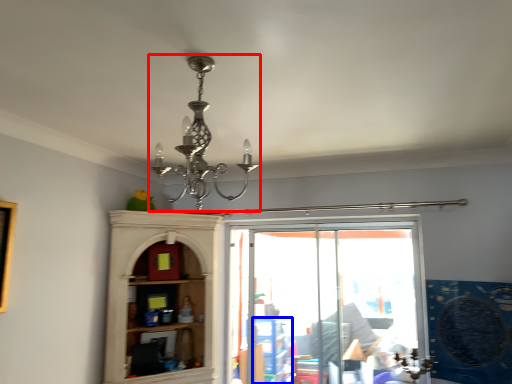
Question: Among these objects, which one is nearest to the camera, lamp (highlighted by a red box) or shelf (highlighted by a blue box)?

Choices:
 (A) lamp
 (B) shelf

Answer: (A)